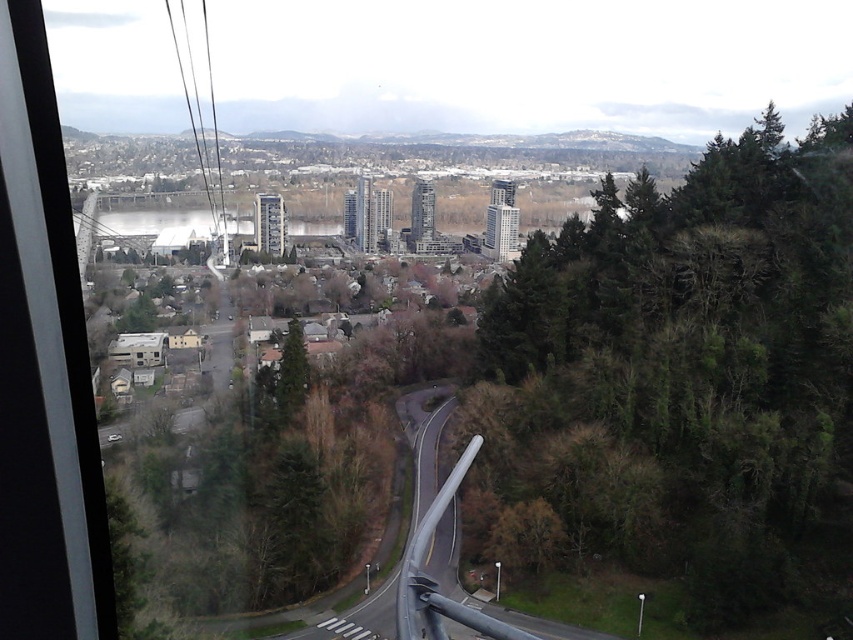
You are a passenger in the cable car and want to describe the view to a friend. Which of the green leafy trees at right or green matte tree at center is positioned higher from your viewpoint?

The green leafy trees at right is located above the green matte tree at center, so it is positioned higher from your viewpoint.

You are a passenger in the cable car and want to compare the trees outside. Which of the two trees, the green leafy trees at right or the green matte tree at center, appears wider from your viewpoint?

The green leafy trees at right appears wider than the green matte tree at center because its width is larger according to the description.